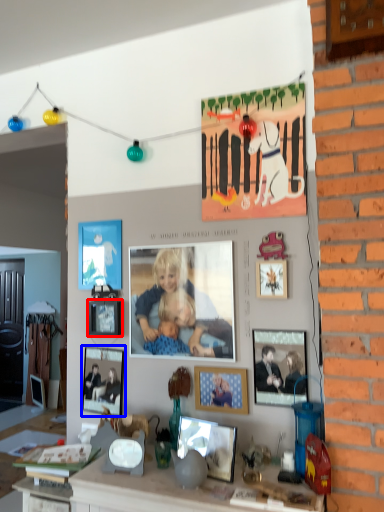
Question: Which of the following is the closest to the observer, picture frame (highlighted by a red box) or picture frame (highlighted by a blue box)?

Choices:
 (A) picture frame
 (B) picture frame

Answer: (A)